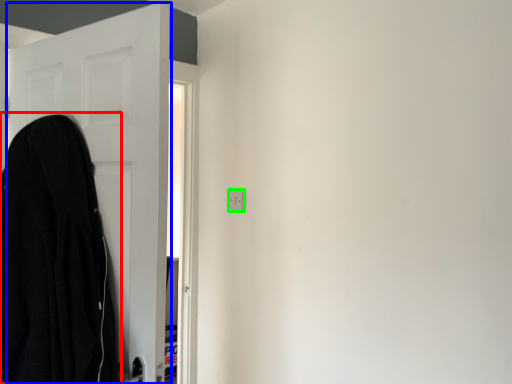
Question: Considering the real-world distances, which object is closest to cloak (highlighted by a red box)? door (highlighted by a blue box) or electric outlet (highlighted by a green box).

Choices:
 (A) door
 (B) electric outlet

Answer: (A)